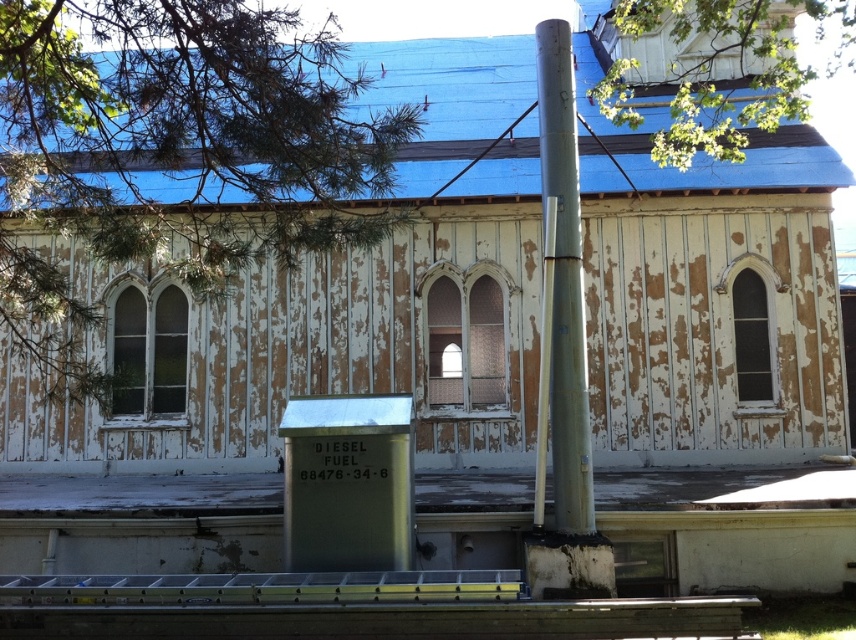
Between green leafy tree at upper left and silver metallic pole at center, which one appears on the right side from the viewer's perspective?

Positioned to the right is silver metallic pole at center.

Does green leafy tree at upper left appear over silver metallic pole at center?

No.

Locate an element on the screen. green leafy tree at upper left is located at coordinates (171, 154).

Which is more to the left, green leafy tree at upper left or green leafy tree at upper center?

green leafy tree at upper left

In the scene shown: Which is below, green leafy tree at upper left or green leafy tree at upper center?

green leafy tree at upper left is lower down.

Is point (80, 140) less distant than point (675, 138)?

Yes, point (80, 140) is in front of point (675, 138).

You are a GUI agent. You are given a task and a screenshot of the screen. Output one action in this format:
    pyautogui.click(x=<x>, y=<y>)
    Task: Click on the green leafy tree at upper left
    
    Given the screenshot: What is the action you would take?
    pyautogui.click(x=171, y=154)

Between green leafy tree at upper center and silver metallic pole at center, which one appears on the left side from the viewer's perspective?

From the viewer's perspective, silver metallic pole at center appears more on the left side.

Is the position of green leafy tree at upper center more distant than that of silver metallic pole at center?

Yes, it is behind silver metallic pole at center.

Between point (629, 68) and point (568, 156), which one is positioned in front?

Positioned in front is point (568, 156).

The width and height of the screenshot is (856, 640). Identify the location of green leafy tree at upper center. (715, 68).